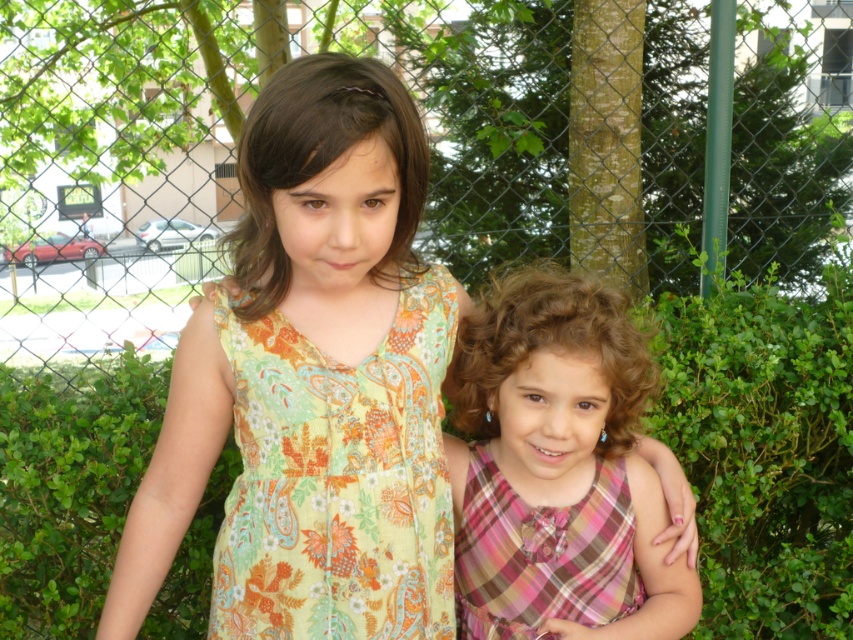
Can you confirm if metallic chain-link fence at center is smaller than floral-patterned fabric dress at center?

No.

Who is more forward, (612, 147) or (236, 500)?

Positioned in front is point (236, 500).

Which is in front, point (143, 193) or point (440, 536)?

Positioned in front is point (440, 536).

The width and height of the screenshot is (853, 640). Find the location of `metallic chain-link fence at center`. metallic chain-link fence at center is located at coordinates (421, 115).

Is floral-patterned dress at center positioned behind pink plaid dress at center?

No, floral-patterned dress at center is in front of pink plaid dress at center.

The width and height of the screenshot is (853, 640). I want to click on floral-patterned dress at center, so click(312, 372).

Who is more forward, (618, 45) or (416, 564)?

Point (416, 564) is more forward.

Can you confirm if metallic chain-link fence at center is shorter than floral-patterned dress at center?

No.

Is point (128, 124) farther from camera compared to point (166, 408)?

Yes.

At what (x,y) coordinates should I click in order to perform the action: click on metallic chain-link fence at center. Please return your answer as a coordinate pair (x, y). Image resolution: width=853 pixels, height=640 pixels. Looking at the image, I should click on (421, 115).